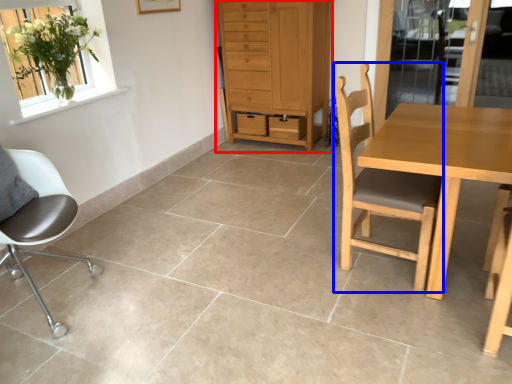
Question: Which of the following is the farthest to the observer, cabinetry (highlighted by a red box) or chair (highlighted by a blue box)?

Choices:
 (A) cabinetry
 (B) chair

Answer: (A)